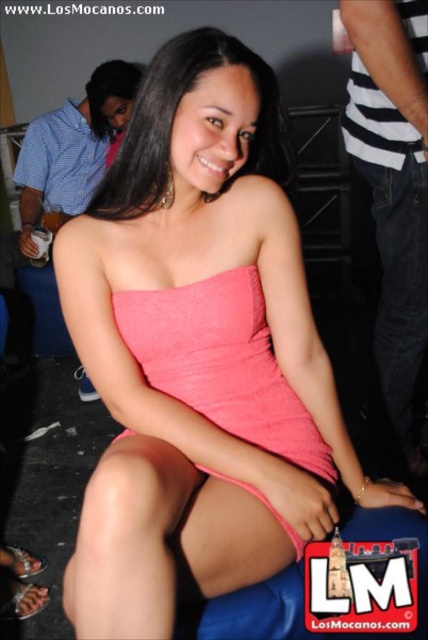
Looking at this image, the woman in the scene is wearing a short dress. There is a point at coordinates (x=394, y=186). Based on the scene description, where is this point located on her clothing?

The point at coordinates (x=394, y=186) is located on the denim shorts at right.

You are at a social event and want to take a photo of the woman in the coral dress. The camera you are using has a limited field of view. There are two points marked in the image, point 1 at coordinates point (392,228) and point 2 at coordinates point (267,500). To ensure both points are in the frame, which point should you position closer to the camera?

Point (392,228) is behind point (267,500), so you should position point (267,500) closer to the camera to ensure both points are in the frame.

The woman is wearing a strapless coral dress. Where are her denim shorts at right?

The denim shorts at right are located at point (394, 186).